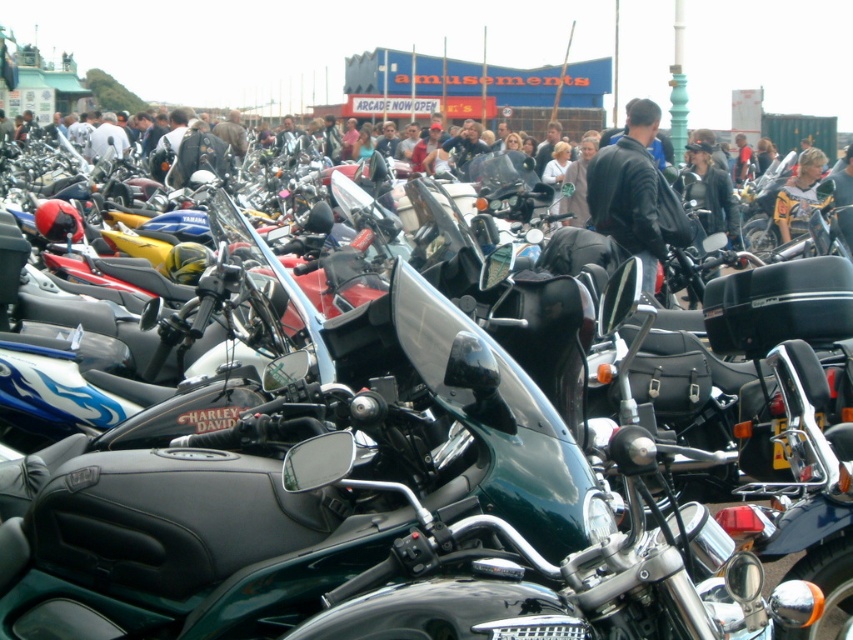
You are a photographer at the motorcycle event. You need to capture a photo of both the black leather jacket at center and the yellow leather jacket at center. Since you want to highlight their thickness, which jacket should you focus on more to show its thickness compared to the other?

The black leather jacket at center is thinner than the yellow leather jacket at center, so you should focus more on the yellow leather jacket at center to emphasize its greater thickness compared to the black one.